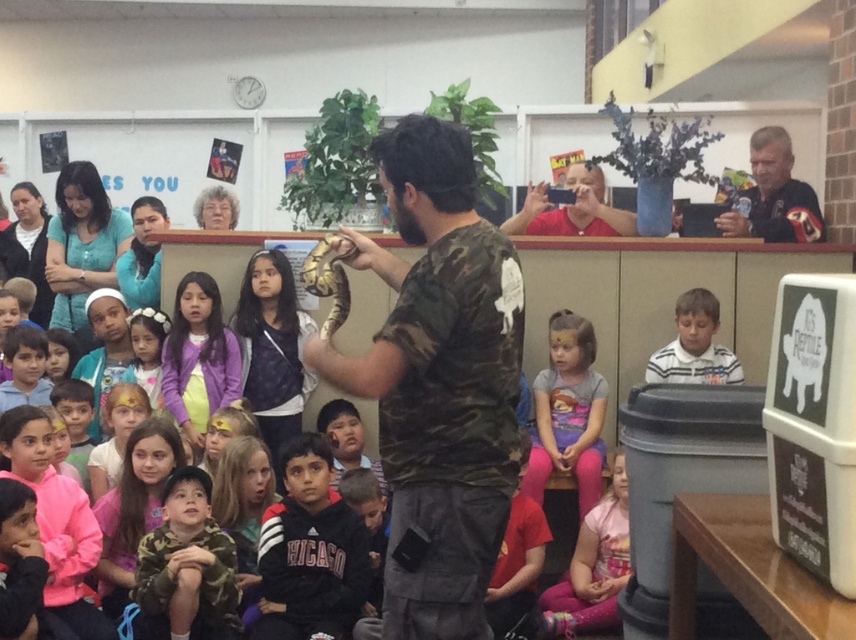
You are a photographer trying to capture a group photo of the camo fabric shirt at lower left and the white striped shirt at center. Based on their positions, which shirt should you focus on first to ensure both are in frame?

The camo fabric shirt at lower left is to the left of the white striped shirt at center, so you should focus on the white striped shirt at center first to ensure both are in frame.

You are a student sitting on the floor in front of the man holding the snake. You notice a point marked at coordinates (187, 564). What object is located at that point?

The camo fabric shirt at lower left is located at point (187, 564).